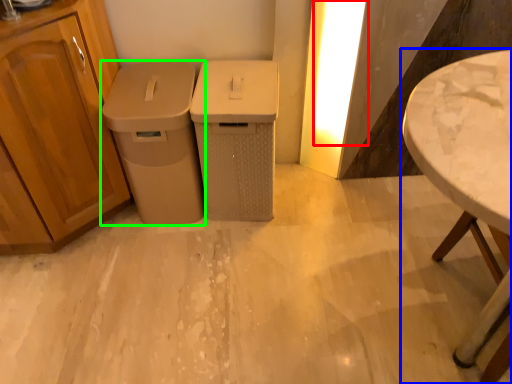
Question: Which object is the farthest from light (highlighted by a red box)? Choose among these: table (highlighted by a blue box) or waste container (highlighted by a green box).

Choices:
 (A) table
 (B) waste container

Answer: (A)